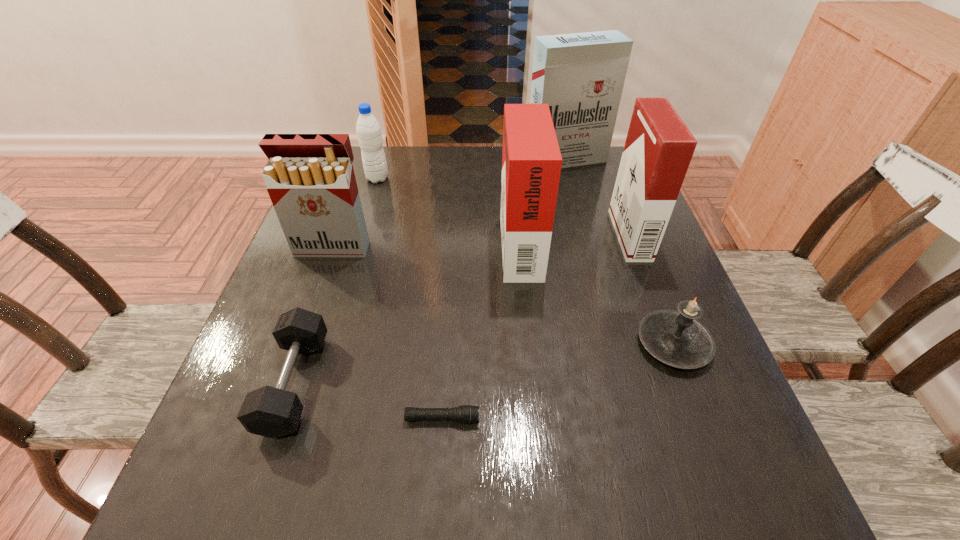
This screenshot has width=960, height=540. What are the coordinates of `object located at the far left corner` in the screenshot? It's located at (368, 129).

The image size is (960, 540). Find the location of `object that is at the far right corner`. object that is at the far right corner is located at coordinates (581, 76).

The width and height of the screenshot is (960, 540). Find the location of `free space at the far edge of the desktop`. free space at the far edge of the desktop is located at coordinates (430, 179).

Image resolution: width=960 pixels, height=540 pixels. What are the coordinates of `free spot at the near edge of the desktop` in the screenshot? It's located at (358, 504).

Identify the location of free space at the left edge of the desktop. The width and height of the screenshot is (960, 540). (285, 288).

This screenshot has height=540, width=960. Find the location of `free space at the right edge of the desktop`. free space at the right edge of the desktop is located at coordinates (612, 239).

Where is `blank space at the far right corner of the desktop`? Image resolution: width=960 pixels, height=540 pixels. blank space at the far right corner of the desktop is located at coordinates (585, 181).

The height and width of the screenshot is (540, 960). I want to click on free region at the near right corner of the desktop, so click(682, 471).

Identify the location of vacant point located between the dumbbell and the sixth tallest object. The width and height of the screenshot is (960, 540). (x=484, y=363).

I want to click on free space between the candle and the flashlight, so click(558, 381).